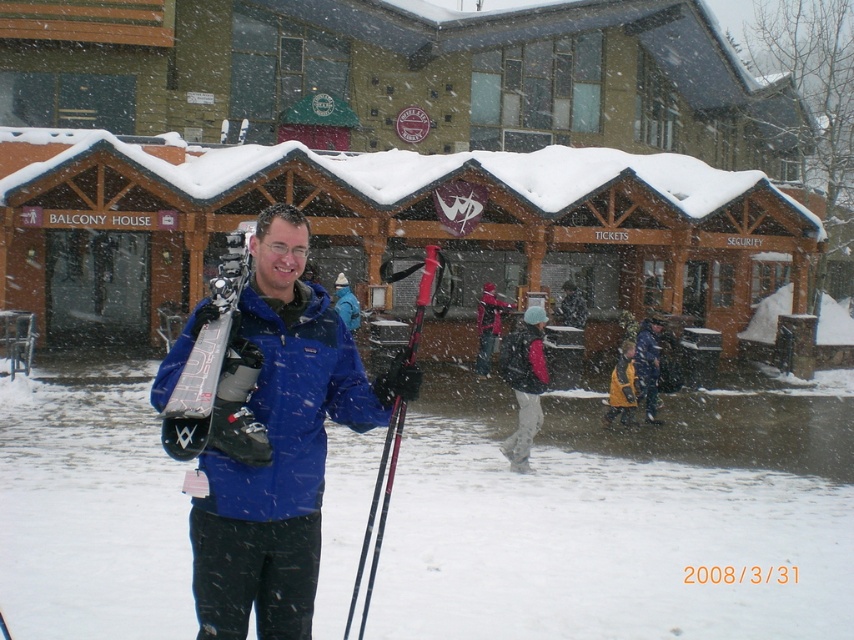
Does blue softshell jacket at center appear on the left side of matte black ski at center?

In fact, blue softshell jacket at center is to the right of matte black ski at center.

Does point (295, 212) come closer to viewer compared to point (205, 422)?

No, it is behind (205, 422).

At what (x,y) coordinates should I click in order to perform the action: click on blue softshell jacket at center. Please return your answer as a coordinate pair (x, y). Looking at the image, I should click on (276, 440).

Can you confirm if matte black ski at center is wider than yellow wool sweater at lower center?

No.

Does matte black ski at center have a larger size compared to yellow wool sweater at lower center?

Incorrect, matte black ski at center is not larger than yellow wool sweater at lower center.

Locate an element on the screen. This screenshot has width=854, height=640. matte black ski at center is located at coordinates (218, 374).

Image resolution: width=854 pixels, height=640 pixels. I want to click on matte black ski at center, so click(x=218, y=374).

Who is taller, black matte jacket at center or yellow wool sweater at lower center?

black matte jacket at center is taller.

Image resolution: width=854 pixels, height=640 pixels. What do you see at coordinates (525, 385) in the screenshot?
I see `black matte jacket at center` at bounding box center [525, 385].

Find the location of a particular element. black matte jacket at center is located at coordinates (525, 385).